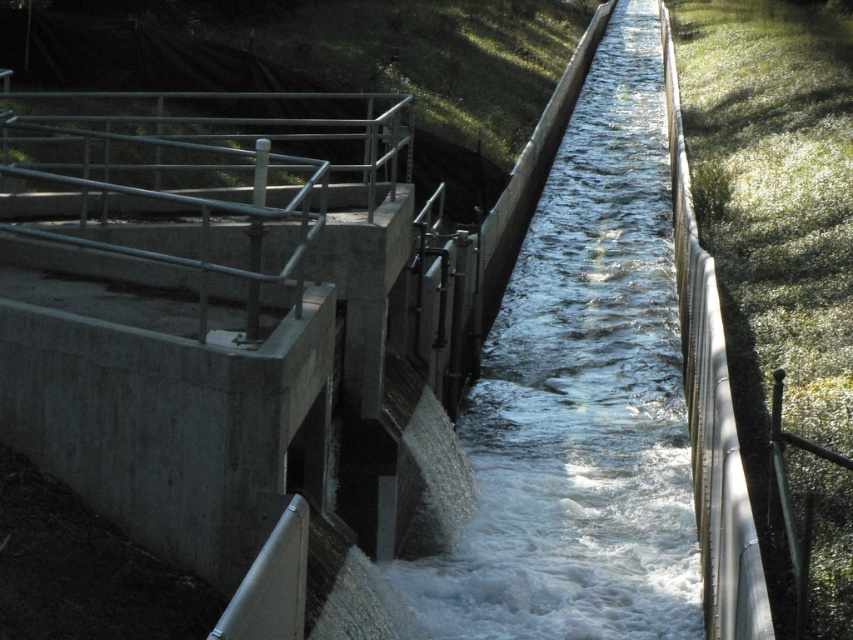
Which is below, clear water at center or metallic silver rail at right?

metallic silver rail at right

Is point (587, 422) closer to camera compared to point (688, 268)?

That is True.

What are the coordinates of `clear water at center` in the screenshot? It's located at 581,396.